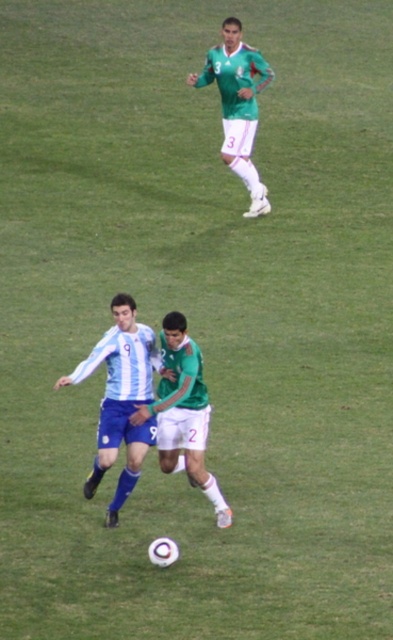
Question: Which of the following is the closest to the observer?

Choices:
 (A) blue jersey at center
 (B) green matte jersey at center

Answer: (A)

Question: Is blue jersey at center to the right of green matte jersey at center from the viewer's perspective?

Choices:
 (A) no
 (B) yes

Answer: (A)

Question: Can you confirm if blue jersey at center is positioned below green matte jersey at upper center?

Choices:
 (A) no
 (B) yes

Answer: (B)

Question: Observing the image, what is the correct spatial positioning of green matte jersey at center in reference to green matte jersey at upper center?

Choices:
 (A) right
 (B) left

Answer: (B)

Question: Based on their relative distances, which object is farther from the blue jersey at center?

Choices:
 (A) green matte jersey at center
 (B) green matte jersey at upper center

Answer: (B)

Question: Which point is closer to the camera taking this photo?

Choices:
 (A) (102, 452)
 (B) (181, 330)
 (C) (216, 67)

Answer: (A)